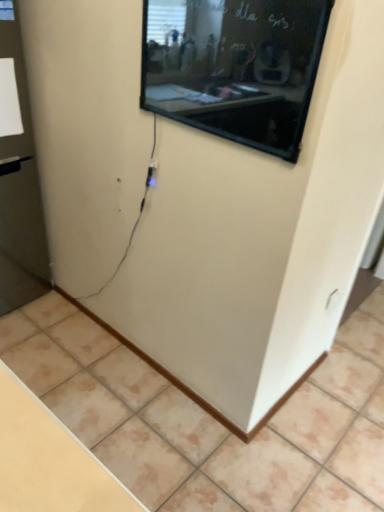
Question: Can you confirm if black glossy screen at upper center is smaller than transparent glass door at left?

Choices:
 (A) no
 (B) yes

Answer: (B)

Question: Is black glossy screen at upper center at the left side of transparent glass door at left?

Choices:
 (A) no
 (B) yes

Answer: (A)

Question: Considering the relative sizes of black glossy screen at upper center and transparent glass door at left in the image provided, is black glossy screen at upper center bigger than transparent glass door at left?

Choices:
 (A) no
 (B) yes

Answer: (A)

Question: Is black glossy screen at upper center outside transparent glass door at left?

Choices:
 (A) yes
 (B) no

Answer: (A)

Question: Can you confirm if black glossy screen at upper center is shorter than transparent glass door at left?

Choices:
 (A) no
 (B) yes

Answer: (B)

Question: Do you think black glossy screen at upper center is within transparent glass door at left, or outside of it?

Choices:
 (A) inside
 (B) outside

Answer: (B)

Question: Is black glossy screen at upper center wider or thinner than transparent glass door at left?

Choices:
 (A) wide
 (B) thin

Answer: (B)

Question: From the image's perspective, is black glossy screen at upper center positioned above or below transparent glass door at left?

Choices:
 (A) below
 (B) above

Answer: (B)

Question: In the image, is black glossy screen at upper center positioned in front of or behind transparent glass door at left?

Choices:
 (A) behind
 (B) front

Answer: (B)

Question: Does point (357, 499) appear closer or farther from the camera than point (284, 117)?

Choices:
 (A) closer
 (B) farther

Answer: (B)

Question: Considering the positions of beige tile at lower center and black glossy screen at upper center in the image, is beige tile at lower center wider or thinner than black glossy screen at upper center?

Choices:
 (A) wide
 (B) thin

Answer: (A)

Question: Considering the positions of beige tile at lower center and black glossy screen at upper center in the image, is beige tile at lower center bigger or smaller than black glossy screen at upper center?

Choices:
 (A) small
 (B) big

Answer: (B)

Question: Considering the relative positions of beige tile at lower center and black glossy screen at upper center in the image provided, is beige tile at lower center to the left or to the right of black glossy screen at upper center?

Choices:
 (A) right
 (B) left

Answer: (A)

Question: From the image's perspective, is transparent glass door at left positioned above or below black glossy screen at upper center?

Choices:
 (A) below
 (B) above

Answer: (A)

Question: Looking at their shapes, would you say transparent glass door at left is wider or thinner than black glossy screen at upper center?

Choices:
 (A) wide
 (B) thin

Answer: (A)